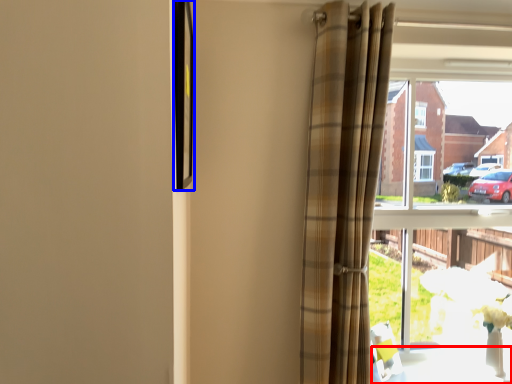
Question: Which point is closer to the camera, table (highlighted by a red box) or picture frame (highlighted by a blue box)?

Choices:
 (A) table
 (B) picture frame

Answer: (B)